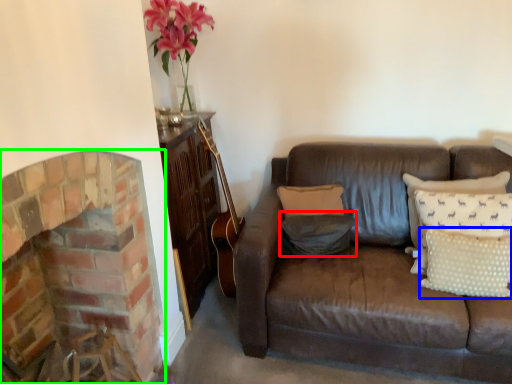
Question: Based on their relative distances, which object is nearer to pillow (highlighted by a red box)? Choose from pillow (highlighted by a blue box) and fireplace (highlighted by a green box).

Choices:
 (A) pillow
 (B) fireplace

Answer: (A)